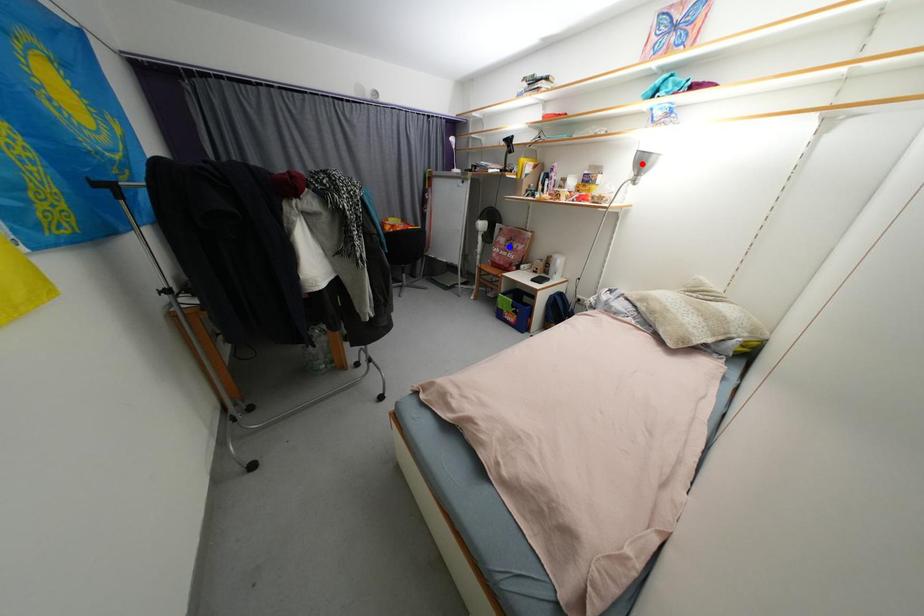
Question: In the image, two points are highlighted. Which point is nearer to the camera? Reply with the corresponding letter.

Choices:
 (A) blue point
 (B) red point

Answer: (B)